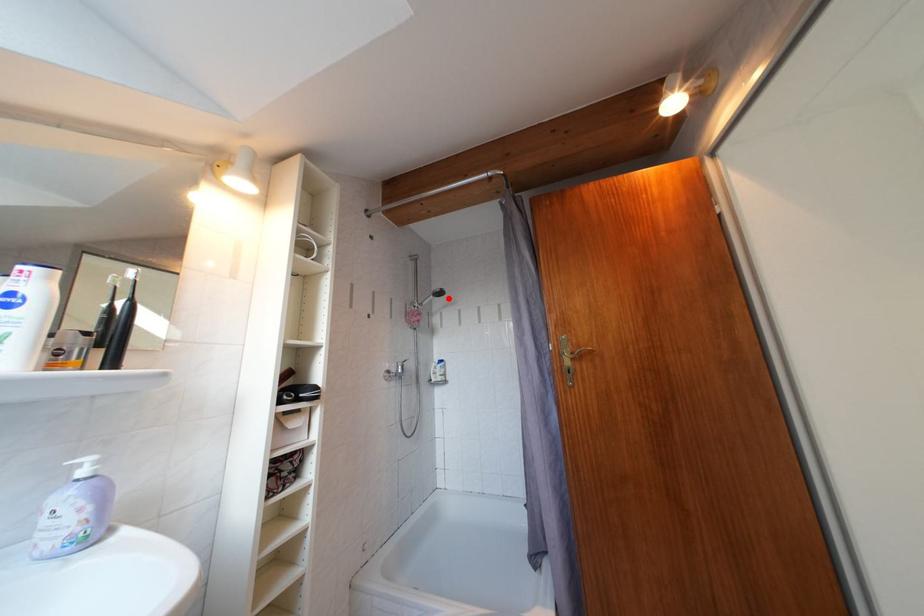
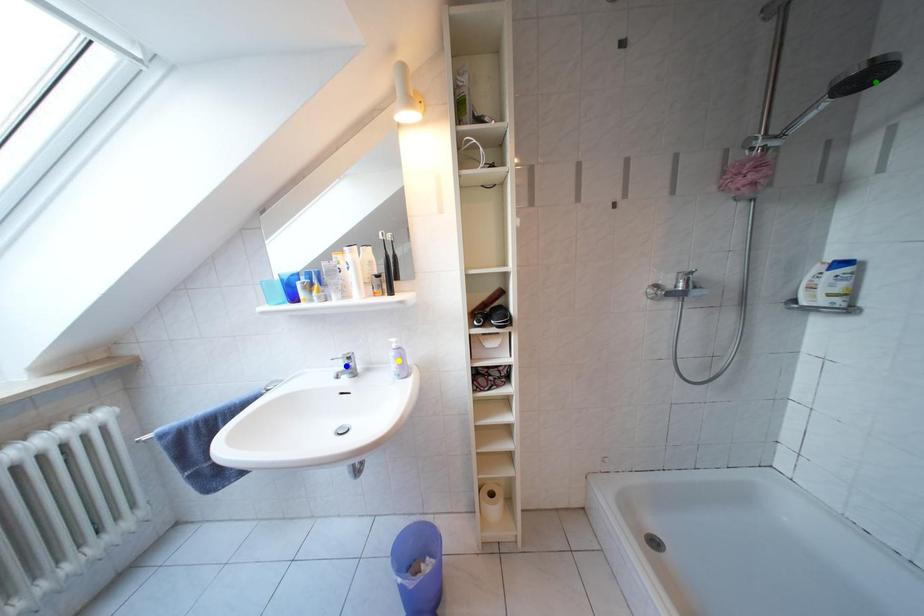
Question: I am providing you with two images of the same scene from different viewpoints. A red point is marked on the first image. You are given multiple points on the second image. Which mark in image 2 goes with the point in image 1?

Choices:
 (A) yellow point
 (B) green point
 (C) blue point

Answer: (B)